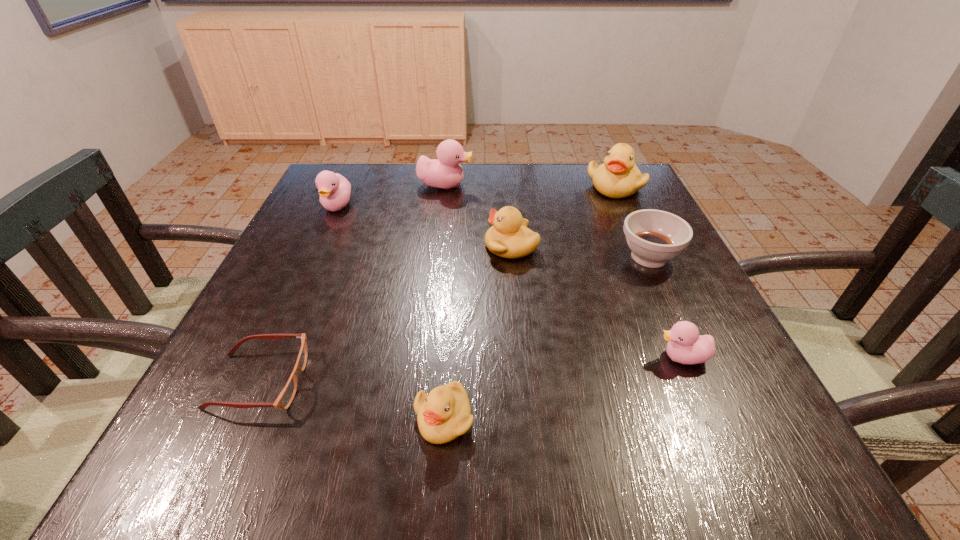
This screenshot has width=960, height=540. I want to click on free region located 0.100m on the front-facing side of the third duckling from right to left, so click(x=440, y=246).

Find the location of a particular element. This screenshot has height=540, width=960. free location located on the front of the soup bowl is located at coordinates (740, 455).

Find the location of a particular element. vacant space located on the front-facing side of the rightmost pink duckling is located at coordinates pyautogui.click(x=432, y=357).

Locate an element on the screen. The image size is (960, 540). vacant area located 0.140m on the front-facing side of the rightmost pink duckling is located at coordinates (573, 357).

Where is `vacant area situated on the front-facing side of the rightmost pink duckling`? This screenshot has width=960, height=540. vacant area situated on the front-facing side of the rightmost pink duckling is located at coordinates (609, 357).

The image size is (960, 540). I want to click on free space located on the front-facing side of the brown spectacles, so click(x=545, y=382).

Where is `object located at the near edge`? object located at the near edge is located at coordinates (444, 414).

Identify the location of duckling that is at the left edge. (334, 189).

Where is `spectacles that is at the left edge`? This screenshot has height=540, width=960. spectacles that is at the left edge is located at coordinates (286, 396).

This screenshot has width=960, height=540. I want to click on soup bowl that is at the right edge, so click(654, 236).